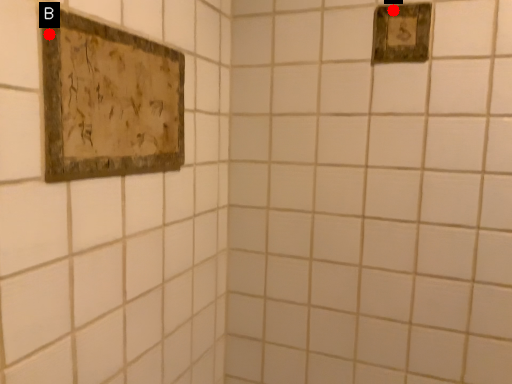
Question: Two points are circled on the image, labeled by A and B beside each circle. Among these points, which one is farthest from the camera?

Choices:
 (A) A is further
 (B) B is further

Answer: (A)